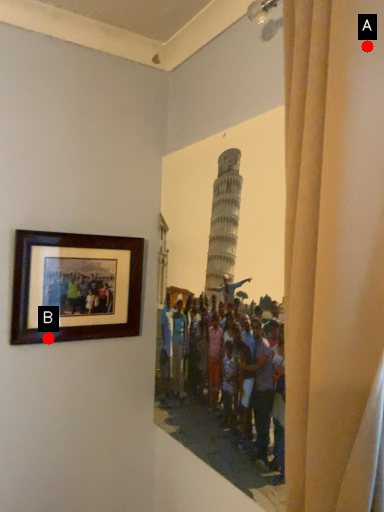
Question: Two points are circled on the image, labeled by A and B beside each circle. Which point is closer to the camera?

Choices:
 (A) A is closer
 (B) B is closer

Answer: (A)